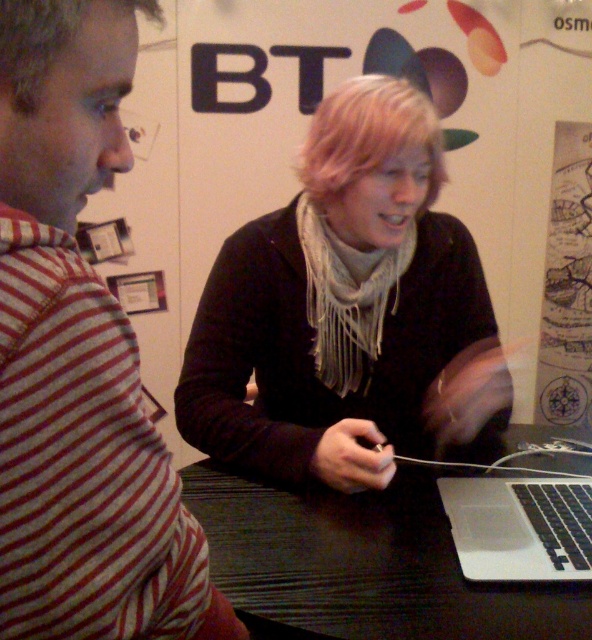
Between point (79, 280) and point (34, 100), which one is positioned behind?

The point (34, 100) is more distant.

Who is positioned more to the left, striped fabric shirt at left or blondehair at left?

From the viewer's perspective, blondehair at left appears more on the left side.

This screenshot has height=640, width=592. Find the location of `striped fabric shirt at left`. striped fabric shirt at left is located at coordinates (79, 358).

Does black wood table at center have a smaller size compared to blondehair at center?

Incorrect, black wood table at center is not smaller in size than blondehair at center.

Between black wood table at center and blondehair at center, which one is positioned lower?

black wood table at center is lower down.

Is point (565, 609) positioned after point (442, 182)?

No, (565, 609) is in front of (442, 182).

At what (x,y) coordinates should I click in order to perform the action: click on black wood table at center. Please return your answer as a coordinate pair (x, y). The height and width of the screenshot is (640, 592). Looking at the image, I should click on click(x=361, y=564).

Is black matte scarf at center to the left of blondehair at center from the viewer's perspective?

No, black matte scarf at center is not to the left of blondehair at center.

Describe the element at coordinates (348, 310) in the screenshot. This screenshot has height=640, width=592. I see `black matte scarf at center` at that location.

Does point (459, 360) come closer to viewer compared to point (314, 140)?

No, it is not.

Where is `black matte scarf at center`? This screenshot has width=592, height=640. black matte scarf at center is located at coordinates (348, 310).